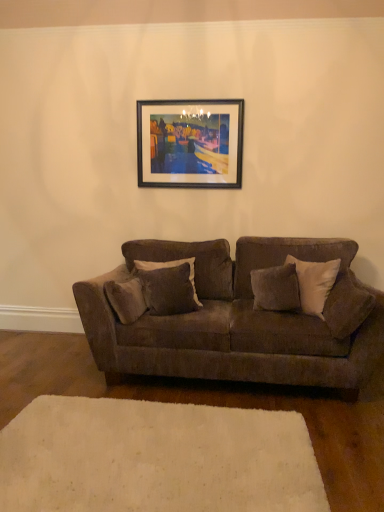
Find the location of a particular element. This screenshot has height=512, width=384. velvet brown couch at center is located at coordinates coord(234,321).

In order to face velvet gray pillow at center, the first pillow positioned from the left, should I rotate leftwards or rightwards?

Turn left by 3.111 degrees to look at velvet gray pillow at center, the first pillow positioned from the left.

Describe the element at coordinates (276, 288) in the screenshot. I see `velvety brown pillow at center, the 2th pillow when ordered from right to left` at that location.

What is the approximate height of wooden-framed artwork at upper center?

28.28 inches.

Find the location of a particular element. white soft rug at lower center is located at coordinates (156, 458).

From a real-world perspective, which is physically below, velvet brown couch at center or velvety brown pillow at center, the 2th pillow when ordered from right to left?

velvet brown couch at center, from a real-world perspective.

How many degrees apart are the facing directions of velvet brown couch at center and velvety brown pillow at center, the 2th pillow when ordered from right to left?

The facing directions of velvet brown couch at center and velvety brown pillow at center, the 2th pillow when ordered from right to left, are 34.3 degrees apart.

You are a GUI agent. You are given a task and a screenshot of the screen. Output one action in this format:
    pyautogui.click(x=<x>, y=<y>)
    Task: Click on the studio couch below the velvety brown pillow at center, the 2th pillow when ordered from right to left (from a real-world perspective)
    The height and width of the screenshot is (512, 384).
    Given the screenshot: What is the action you would take?
    pyautogui.click(x=234, y=321)

Is velvet brown couch at center not near velvety brown pillow at center, the 2th pillow when ordered from right to left?

No, velvet brown couch at center is in close proximity to velvety brown pillow at center, the 2th pillow when ordered from right to left.

Is white soft rug at lower center located outside velvet brown couch at center?

white soft rug at lower center lies outside velvet brown couch at center's area.

From their relative heights in the image, would you say white soft rug at lower center is taller or shorter than velvet brown couch at center?

white soft rug at lower center is shorter than velvet brown couch at center.

Is point (19, 446) positioned after point (230, 258)?

No.

Considering the sizes of velvety brown pillow at center, the 2th pillow from the left, and white soft rug at lower center in the image, is velvety brown pillow at center, the 2th pillow from the left, taller or shorter than white soft rug at lower center?

Considering their sizes, velvety brown pillow at center, the 2th pillow from the left, has more height than white soft rug at lower center.

From a real-world perspective, is velvety brown pillow at center, the 2th pillow when ordered from right to left, physically located above or below white soft rug at lower center?

In terms of real-world spatial position, velvety brown pillow at center, the 2th pillow when ordered from right to left, is above white soft rug at lower center.

Relative to white soft rug at lower center, is velvety brown pillow at center, the 2th pillow from the left, in front or behind?

velvety brown pillow at center, the 2th pillow from the left, is positioned farther from the viewer than white soft rug at lower center.

Find the location of a particular element. This screenshot has height=512, width=384. plain located in front of the velvety brown pillow at center, the 2th pillow from the left is located at coordinates (156, 458).

Is point (147, 261) closer or farther from the camera than point (268, 307)?

Point (147, 261) is farther from the camera than point (268, 307).

From a real-world perspective, is velvet gray pillow at center, which is the third pillow from right to left, physically above velvety brown pillow at center, the 2th pillow when ordered from right to left?

Correct, in the physical world, velvet gray pillow at center, which is the third pillow from right to left, is higher than velvety brown pillow at center, the 2th pillow when ordered from right to left.

What's the angular difference between velvet gray pillow at center, which is the third pillow from right to left, and velvety brown pillow at center, the 2th pillow from the left,'s facing directions?

53.2 degrees separate the facing orientations of velvet gray pillow at center, which is the third pillow from right to left, and velvety brown pillow at center, the 2th pillow from the left.

In the scene shown: Is the depth of velvet gray pillow at center, which is the third pillow from right to left, greater than that of velvety brown pillow at center, the 2th pillow when ordered from right to left?

Yes, velvet gray pillow at center, which is the third pillow from right to left, is behind velvety brown pillow at center, the 2th pillow when ordered from right to left.

Which of these two, wooden-framed artwork at upper center or velvet brown couch at center, is wider?

With larger width is velvet brown couch at center.

Based on their positions, is wooden-framed artwork at upper center located to the left or right of velvet brown couch at center?

From the image, it's evident that wooden-framed artwork at upper center is to the left of velvet brown couch at center.

Between wooden-framed artwork at upper center and velvet brown couch at center, which one has less height?

With less height is wooden-framed artwork at upper center.

Is there a large distance between wooden-framed artwork at upper center and velvet brown couch at center?

Yes, wooden-framed artwork at upper center and velvet brown couch at center are located far from each other.

Is wooden-framed artwork at upper center not near soft gray fabric pillow at right, the 3th pillow in the left-to-right sequence?

Indeed, wooden-framed artwork at upper center is not near soft gray fabric pillow at right, the 3th pillow in the left-to-right sequence.

Where is `pillow that is the 3rd object located below the wooden-framed artwork at upper center (from the image's perspective)`? The width and height of the screenshot is (384, 512). pillow that is the 3rd object located below the wooden-framed artwork at upper center (from the image's perspective) is located at coordinates (346, 305).

How many degrees apart are the facing directions of wooden-framed artwork at upper center and soft gray fabric pillow at right, which is the first pillow in right-to-left order?

The angular difference between wooden-framed artwork at upper center and soft gray fabric pillow at right, which is the first pillow in right-to-left order, is 87 degrees.

Is point (216, 141) behind point (351, 323)?

That is True.

Would you say white soft rug at lower center is part of velvet brown couch at center's contents?

Actually, white soft rug at lower center is outside velvet brown couch at center.

From the image's perspective, is velvet brown couch at center under white soft rug at lower center?

Actually, velvet brown couch at center appears above white soft rug at lower center in the image.

Consider the image. Considering the relative sizes of velvet brown couch at center and white soft rug at lower center in the image provided, is velvet brown couch at center bigger than white soft rug at lower center?

Yes, velvet brown couch at center is bigger than white soft rug at lower center.

From a real-world perspective, which object stands above the other?

From a 3D spatial view, velvet brown couch at center is above.

Locate an element on the screen. The height and width of the screenshot is (512, 384). studio couch located on the left of velvety brown pillow at center, the 2th pillow from the left is located at coordinates (234, 321).

The width and height of the screenshot is (384, 512). I want to click on studio couch behind the white soft rug at lower center, so click(234, 321).

From the image, which object appears to be nearer to white soft rug at lower center, velvet brown couch at center or wooden-framed artwork at upper center?

The object closer to white soft rug at lower center is velvet brown couch at center.

Which object lies further to the anchor point velvety brown pillow at center, the 2th pillow from the left, soft gray fabric pillow at right, the 3th pillow in the left-to-right sequence, or velvet gray pillow at center, the first pillow positioned from the left?

Based on the image, velvet gray pillow at center, the first pillow positioned from the left, appears to be further to velvety brown pillow at center, the 2th pillow from the left.

Looking at this image, based on their spatial positions, is velvet brown couch at center or wooden-framed artwork at upper center closer to velvet gray pillow at center, which is the third pillow from right to left?

Among the two, velvet brown couch at center is located nearer to velvet gray pillow at center, which is the third pillow from right to left.

Looking at the image, which one is located closer to velvety brown pillow at center, the 2th pillow from the left, white soft rug at lower center or velvet brown couch at center?

Among the two, velvet brown couch at center is located nearer to velvety brown pillow at center, the 2th pillow from the left.

Which object lies nearer to the anchor point velvet gray pillow at center, the first pillow positioned from the left, soft gray fabric pillow at right, the 3th pillow in the left-to-right sequence, or wooden-framed artwork at upper center?

Based on the image, wooden-framed artwork at upper center appears to be nearer to velvet gray pillow at center, the first pillow positioned from the left.

Which object lies further to the anchor point velvet gray pillow at center, the first pillow positioned from the left, velvet brown couch at center or soft gray fabric pillow at right, the 3th pillow in the left-to-right sequence?

Based on the image, soft gray fabric pillow at right, the 3th pillow in the left-to-right sequence, appears to be further to velvet gray pillow at center, the first pillow positioned from the left.

Based on the photo, from the image, which object appears to be nearer to soft gray fabric pillow at right, the 3th pillow in the left-to-right sequence, velvet brown couch at center or velvet gray pillow at center, the first pillow positioned from the left?

velvet brown couch at center is positioned closer to the anchor soft gray fabric pillow at right, the 3th pillow in the left-to-right sequence.

When comparing their distances from velvet gray pillow at center, which is the third pillow from right to left, does wooden-framed artwork at upper center or velvety brown pillow at center, the 2th pillow when ordered from right to left, seem further?

Based on the image, wooden-framed artwork at upper center appears to be further to velvet gray pillow at center, which is the third pillow from right to left.

Find the location of a particular element. The height and width of the screenshot is (512, 384). pillow between white soft rug at lower center and velvety brown pillow at center, the 2th pillow from the left, from front to back is located at coordinates (346, 305).

The image size is (384, 512). I want to click on studio couch between velvet gray pillow at center, the first pillow positioned from the left, and velvety brown pillow at center, the 2th pillow from the left, so click(234, 321).

Where is `studio couch between wooden-framed artwork at upper center and white soft rug at lower center from top to bottom`? Image resolution: width=384 pixels, height=512 pixels. studio couch between wooden-framed artwork at upper center and white soft rug at lower center from top to bottom is located at coordinates (234, 321).

At what (x,y) coordinates should I click in order to perform the action: click on pillow between velvet brown couch at center and soft gray fabric pillow at right, the 3th pillow in the left-to-right sequence. Please return your answer as a coordinate pair (x, y). Image resolution: width=384 pixels, height=512 pixels. Looking at the image, I should click on (276, 288).